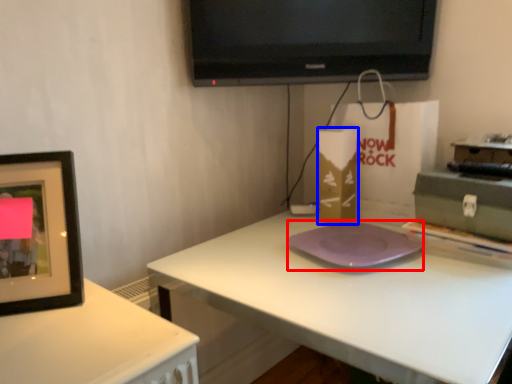
Question: Which point is further to the camera, pad (highlighted by a red box) or cardboard box (highlighted by a blue box)?

Choices:
 (A) pad
 (B) cardboard box

Answer: (B)